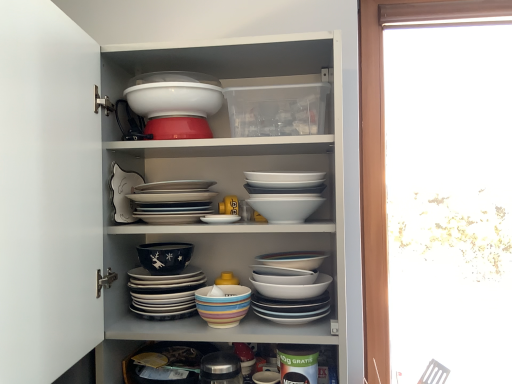
Question: Which direction should I rotate to look at multicolored ceramic bowls at center, arranged as the 6th bowl when viewed from the top, — up or down?

Choices:
 (A) down
 (B) up

Answer: (A)

Question: Is white glossy plate at center, positioned as the fourth bowl in top-to-bottom order, not near multicolored ceramic bowl at center, which ranks as the 1th bowl in bottom-to-top order?

Choices:
 (A) yes
 (B) no

Answer: (B)

Question: Does white glossy plate at center, which ranks as the fifth bowl in bottom-to-top order, come behind multicolored ceramic bowl at center, the eighth bowl viewed from the top?

Choices:
 (A) no
 (B) yes

Answer: (B)

Question: Does white glossy plate at center, positioned as the fourth bowl in top-to-bottom order, have a larger size compared to multicolored ceramic bowl at center, the eighth bowl viewed from the top?

Choices:
 (A) yes
 (B) no

Answer: (A)

Question: Does white glossy plate at center, which ranks as the fifth bowl in bottom-to-top order, touch multicolored ceramic bowl at center, the eighth bowl viewed from the top?

Choices:
 (A) no
 (B) yes

Answer: (A)

Question: Considering the relative sizes of white glossy plate at center, which ranks as the fifth bowl in bottom-to-top order, and multicolored ceramic bowl at center, the eighth bowl viewed from the top, in the image provided, is white glossy plate at center, which ranks as the fifth bowl in bottom-to-top order, shorter than multicolored ceramic bowl at center, the eighth bowl viewed from the top,?

Choices:
 (A) no
 (B) yes

Answer: (A)

Question: From the image's perspective, is white glossy plate at center, positioned as the fourth bowl in top-to-bottom order, on multicolored ceramic bowl at center, which ranks as the 1th bowl in bottom-to-top order?

Choices:
 (A) yes
 (B) no

Answer: (A)

Question: Is multicolored ceramic bowls at center, arranged as the 6th bowl when viewed from the top, positioned with its back to white glossy plate at center, positioned as the fourth bowl in top-to-bottom order?

Choices:
 (A) yes
 (B) no

Answer: (B)

Question: Considering the relative sizes of multicolored ceramic bowls at center, which is the 3th bowl in bottom-to-top order, and white glossy plate at center, positioned as the fourth bowl in top-to-bottom order, in the image provided, is multicolored ceramic bowls at center, which is the 3th bowl in bottom-to-top order, thinner than white glossy plate at center, positioned as the fourth bowl in top-to-bottom order,?

Choices:
 (A) yes
 (B) no

Answer: (A)

Question: Is multicolored ceramic bowls at center, arranged as the 6th bowl when viewed from the top, bigger than white glossy plate at center, positioned as the fourth bowl in top-to-bottom order?

Choices:
 (A) yes
 (B) no

Answer: (A)

Question: Considering the relative sizes of multicolored ceramic bowls at center, which is the 3th bowl in bottom-to-top order, and white glossy plate at center, positioned as the fourth bowl in top-to-bottom order, in the image provided, is multicolored ceramic bowls at center, which is the 3th bowl in bottom-to-top order, shorter than white glossy plate at center, positioned as the fourth bowl in top-to-bottom order,?

Choices:
 (A) no
 (B) yes

Answer: (A)

Question: Does multicolored ceramic bowls at center, which is the 3th bowl in bottom-to-top order, appear on the left side of white glossy plate at center, which ranks as the fifth bowl in bottom-to-top order?

Choices:
 (A) no
 (B) yes

Answer: (A)

Question: From a real-world perspective, does multicolored ceramic bowls at center, arranged as the 6th bowl when viewed from the top, sit lower than white glossy plate at center, positioned as the fourth bowl in top-to-bottom order?

Choices:
 (A) no
 (B) yes

Answer: (B)

Question: Considering the relative sizes of white glossy bowl at upper center, acting as the eighth bowl starting from the bottom, and white glossy bowls at center, which is the sixth bowl in bottom-to-top order, in the image provided, is white glossy bowl at upper center, acting as the eighth bowl starting from the bottom, shorter than white glossy bowls at center, which is the sixth bowl in bottom-to-top order,?

Choices:
 (A) no
 (B) yes

Answer: (B)